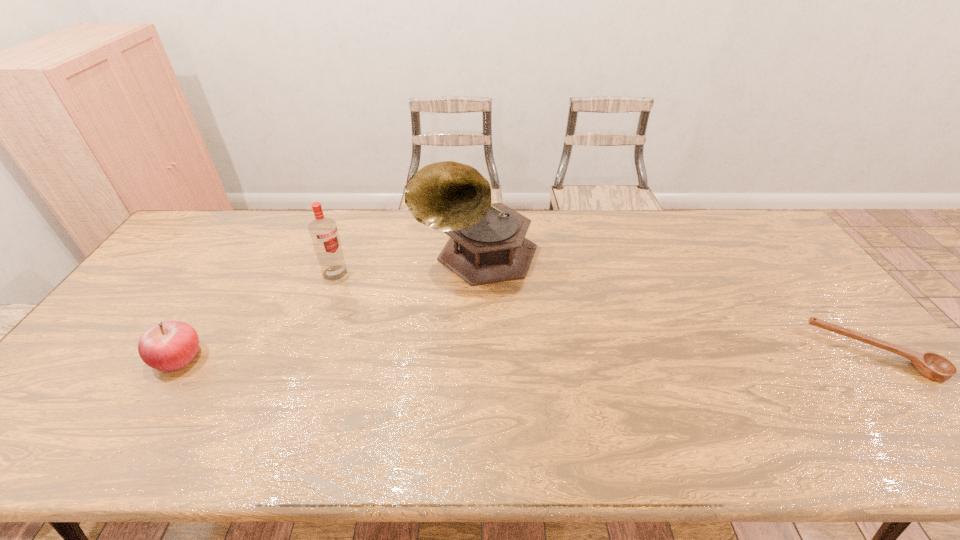
The image size is (960, 540). I want to click on free space on the desktop that is between the apple and the rightmost object and is positioned on the horn direction of the tallest object, so click(424, 356).

Image resolution: width=960 pixels, height=540 pixels. In order to click on free spot on the desktop that is between the second shortest object and the rightmost object and is positioned on the front label of the vodka in this screenshot , I will do `click(422, 356)`.